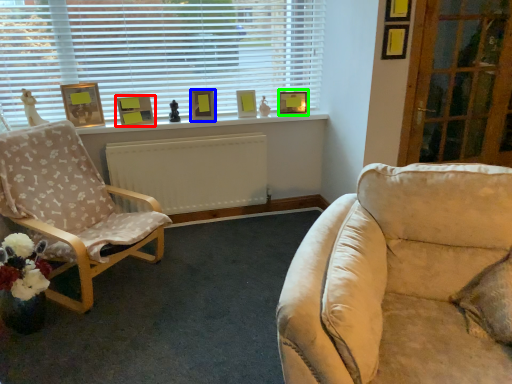
Question: Estimate the real-world distances between objects in this image. Which object is farther from picture frame (highlighted by a red box), picture frame (highlighted by a blue box) or picture frame (highlighted by a green box)?

Choices:
 (A) picture frame
 (B) picture frame

Answer: (B)